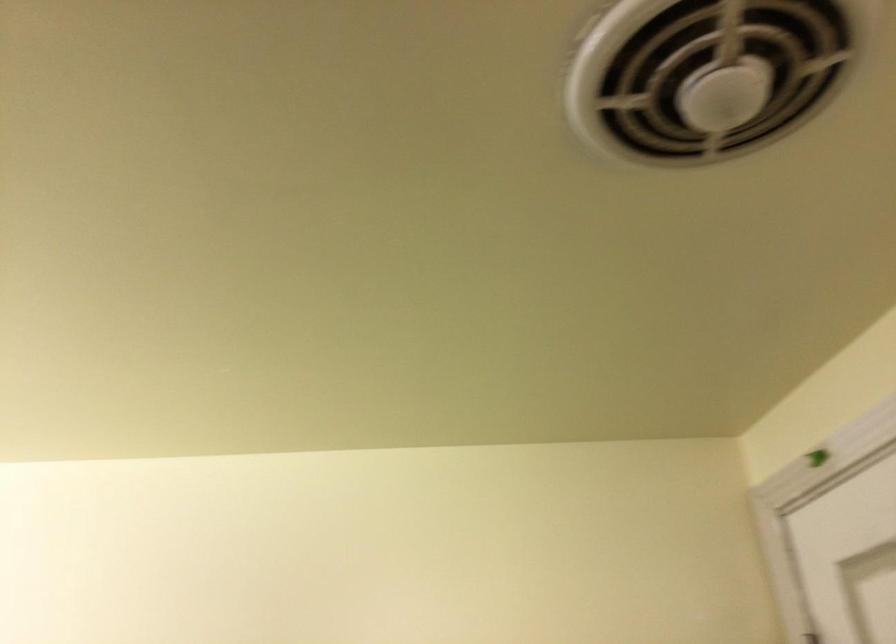
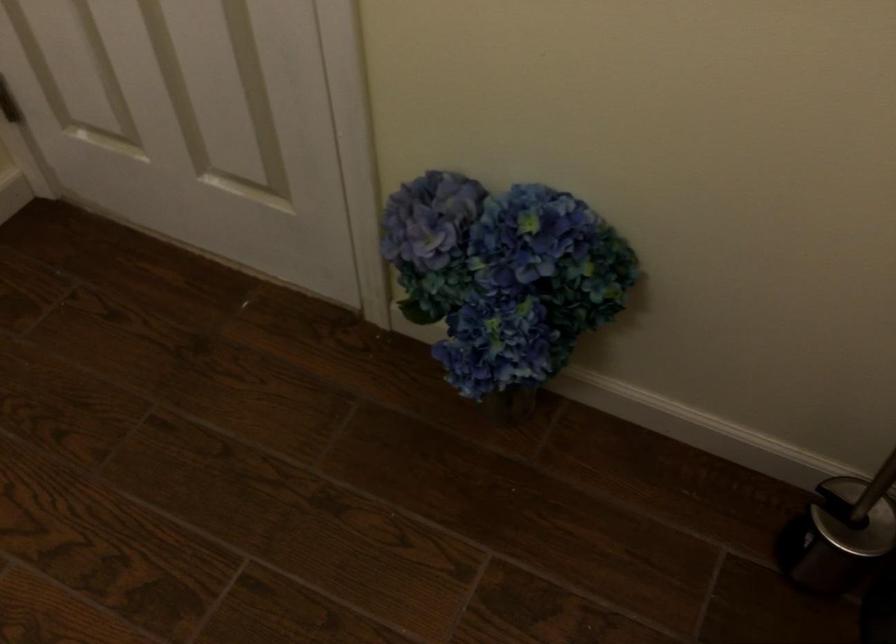
The images are taken continuously from a first-person perspective. In which direction is your viewpoint rotating?

The rotation direction of the camera is right-down.